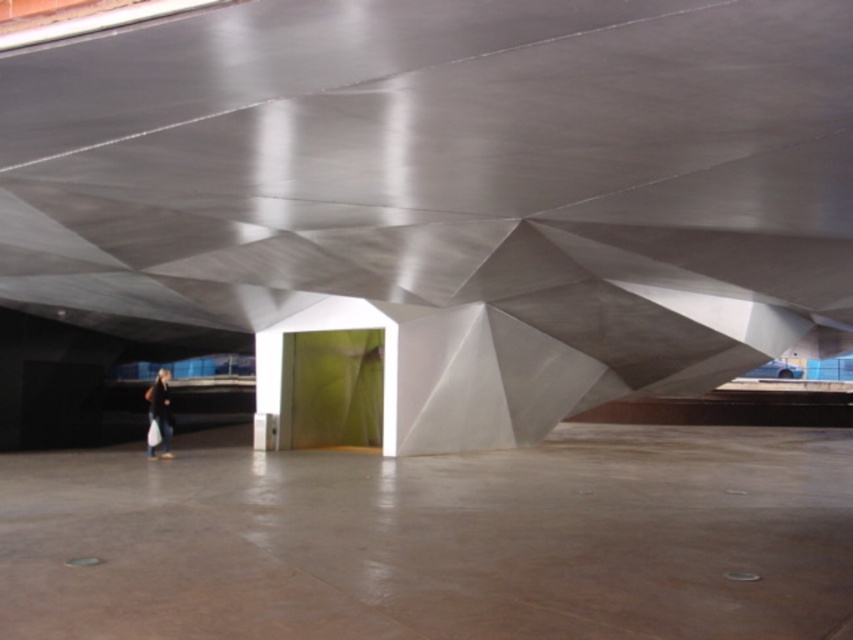
Which is below, metallic silver structure at center or smooth concrete floor at center?

smooth concrete floor at center

This screenshot has height=640, width=853. Find the location of `metallic silver structure at center`. metallic silver structure at center is located at coordinates (445, 195).

Does smooth concrete floor at center come behind dark blue jeans at lower left?

No, smooth concrete floor at center is in front of dark blue jeans at lower left.

Between point (666, 632) and point (160, 440), which one is positioned in front?

Point (666, 632) is in front.

The height and width of the screenshot is (640, 853). Describe the element at coordinates (437, 540) in the screenshot. I see `smooth concrete floor at center` at that location.

Locate an element on the screen. This screenshot has width=853, height=640. smooth concrete floor at center is located at coordinates (437, 540).

Based on the photo, does metallic silver structure at center appear under dark blue jeans at lower left?

Actually, metallic silver structure at center is above dark blue jeans at lower left.

Is point (561, 266) positioned in front of point (158, 428)?

Yes, point (561, 266) is closer to viewer.

Describe the element at coordinates (445, 195) in the screenshot. This screenshot has width=853, height=640. I see `metallic silver structure at center` at that location.

You are a GUI agent. You are given a task and a screenshot of the screen. Output one action in this format:
    pyautogui.click(x=<x>, y=<y>)
    Task: Click on the metallic silver structure at center
    
    Given the screenshot: What is the action you would take?
    pyautogui.click(x=445, y=195)